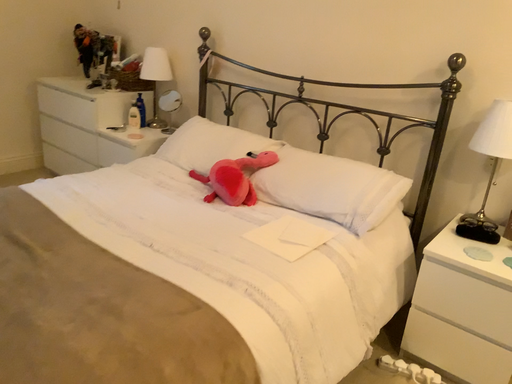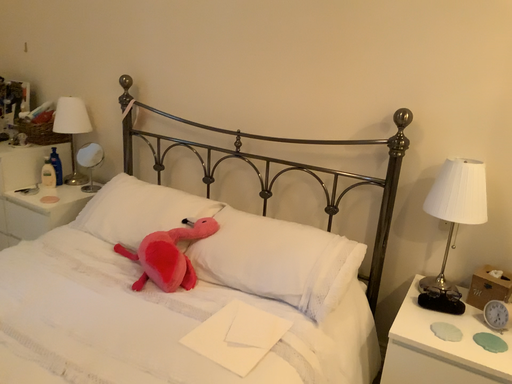
Question: How did the camera likely rotate when shooting the video?

Choices:
 (A) rotated right
 (B) rotated left

Answer: (A)